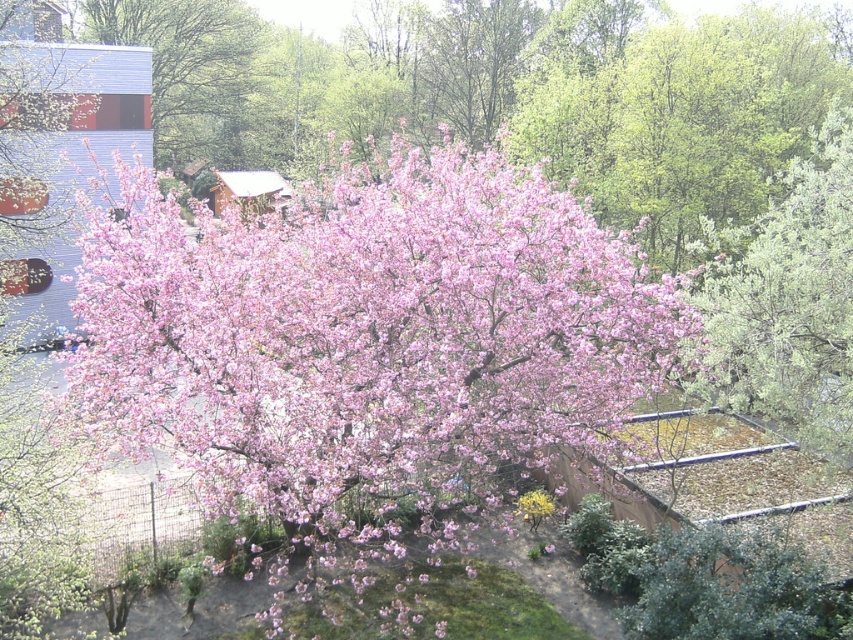
Question: Can you confirm if pink matte tree at center is thinner than pink matte tree at upper left?

Choices:
 (A) no
 (B) yes

Answer: (A)

Question: Which point appears closest to the camera in this image?

Choices:
 (A) (189, 17)
 (B) (263, 384)

Answer: (B)

Question: Which object is closer to the camera taking this photo?

Choices:
 (A) pink matte tree at center
 (B) pink matte tree at upper left

Answer: (A)

Question: From the image, what is the correct spatial relationship of pink matte tree at center in relation to pink matte tree at upper left?

Choices:
 (A) left
 (B) right

Answer: (B)

Question: Can you confirm if pink matte tree at center is thinner than pink matte tree at upper left?

Choices:
 (A) yes
 (B) no

Answer: (B)